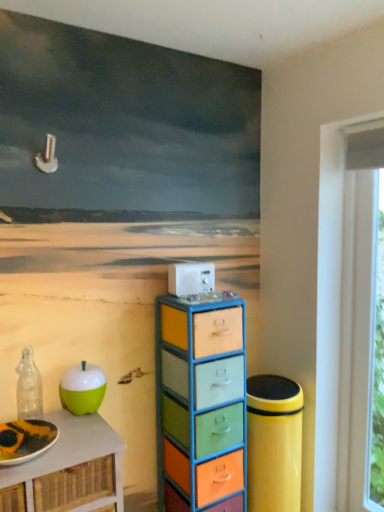
Where is `white plastic appliance at center`? white plastic appliance at center is located at coordinates (191, 278).

This screenshot has width=384, height=512. What do you see at coordinates (82, 388) in the screenshot? I see `green matte apple at lower left` at bounding box center [82, 388].

The height and width of the screenshot is (512, 384). What do you see at coordinates (331, 298) in the screenshot?
I see `white plastic window frame at right` at bounding box center [331, 298].

Describe the element at coordinates (25, 440) in the screenshot. I see `matte white plate at lower left` at that location.

At what (x,y) coordinates should I click in order to perform the action: click on green matte apple at left. Please return your answer as a coordinate pair (x, y). This screenshot has height=512, width=384. Looking at the image, I should click on (x=72, y=468).

This screenshot has width=384, height=512. In order to click on white plastic appliance at center in this screenshot , I will do `click(191, 278)`.

Are green matte apple at left and white plastic window frame at right far apart?

Yes, green matte apple at left and white plastic window frame at right are quite far apart.

Can we say green matte apple at left lies outside white plastic window frame at right?

Yes.

Which object is closer to the camera, green matte apple at left or white plastic window frame at right?

green matte apple at left is more forward.

Does green matte apple at left appear on the right side of white plastic window frame at right?

Incorrect, green matte apple at left is not on the right side of white plastic window frame at right.

Are green matte apple at left and green matte apple at lower left located far from each other?

No, green matte apple at left is not far from green matte apple at lower left.

In terms of height, does green matte apple at left look taller or shorter compared to green matte apple at lower left?

Clearly, green matte apple at left is taller compared to green matte apple at lower left.

Is green matte apple at left completely or partially outside of green matte apple at lower left?

Absolutely, green matte apple at left is external to green matte apple at lower left.

From a real-world perspective, is green matte apple at left on green matte apple at lower left?

No, from a real-world perspective, green matte apple at left is not above green matte apple at lower left.

You are a GUI agent. You are given a task and a screenshot of the screen. Output one action in this format:
    pyautogui.click(x=<x>, y=<y>)
    Task: Click on the appliance lying above the multicolored painted drawers at center (from the image's perspective)
    
    Given the screenshot: What is the action you would take?
    pyautogui.click(x=191, y=278)

In the scene shown: Is white plastic appliance at center not close to multicolored painted drawers at center?

No, white plastic appliance at center is not far away from multicolored painted drawers at center.

Does point (214, 277) come in front of point (233, 467)?

No, (214, 277) is behind (233, 467).

Could you tell me if white plastic appliance at center is facing multicolored painted drawers at center?

No.

Which object is further away from the camera, matte white plate at lower left or multicolored painted drawers at center?

multicolored painted drawers at center is more distant.

From a real-world perspective, is matte white plate at lower left positioned above or below multicolored painted drawers at center?

In terms of real-world spatial position, matte white plate at lower left is above multicolored painted drawers at center.

Which is farther from the camera, (28, 429) or (221, 471)?

The point (221, 471) is behind.

The width and height of the screenshot is (384, 512). Identify the location of the chest of drawers beneath the matte white plate at lower left (from a real-world perspective). click(x=201, y=400).

How many degrees apart are the facing directions of white plastic appliance at center and green matte apple at lower left?

white plastic appliance at center and green matte apple at lower left are facing 1.58 degrees away from each other.

Considering the sizes of objects white plastic appliance at center and green matte apple at lower left in the image provided, who is bigger, white plastic appliance at center or green matte apple at lower left?

green matte apple at lower left is bigger.

Find the location of a particular element. apple that is below the white plastic appliance at center (from the image's perspective) is located at coordinates (82, 388).

Is white plastic appliance at center positioned with its back to green matte apple at lower left?

white plastic appliance at center does not have its back to green matte apple at lower left.

How many degrees apart are the facing directions of green matte apple at left and multicolored painted drawers at center?

0.879 degrees.

From a real-world perspective, is green matte apple at left beneath multicolored painted drawers at center?

Indeed, from a real-world perspective, green matte apple at left is positioned beneath multicolored painted drawers at center.

Could you tell me if green matte apple at left is facing multicolored painted drawers at center?

No, green matte apple at left does not turn towards multicolored painted drawers at center.

Relative to multicolored painted drawers at center, is green matte apple at left in front or behind?

In the image, green matte apple at left appears in front of multicolored painted drawers at center.

Is matte white plate at lower left touching white plastic appliance at center?

No, matte white plate at lower left is not with white plastic appliance at center.

How different are the orientations of matte white plate at lower left and white plastic appliance at center in degrees?

0.366 degrees.

From a real-world perspective, between matte white plate at lower left and white plastic appliance at center, who is vertically higher?

white plastic appliance at center.

Can you confirm if matte white plate at lower left is thinner than white plastic appliance at center?

In fact, matte white plate at lower left might be wider than white plastic appliance at center.

Find the location of a particular element. This screenshot has height=512, width=384. window frame that is behind the green matte apple at left is located at coordinates (331, 298).

At what (x,y) coordinates should I click in order to perform the action: click on table that is in front of the green matte apple at lower left. Please return your answer as a coordinate pair (x, y). The height and width of the screenshot is (512, 384). Looking at the image, I should click on (72, 468).

Looking at the image, which one is located closer to multicolored painted drawers at center, matte white plate at lower left or white plastic window frame at right?

white plastic window frame at right is closer to multicolored painted drawers at center.

Looking at the image, which one is located closer to green matte apple at left, white plastic window frame at right or transparent glass bottle at left?

transparent glass bottle at left is closer to green matte apple at left.

Based on their spatial positions, is white plastic appliance at center or green matte apple at lower left further from matte white plate at lower left?

Based on the image, white plastic appliance at center appears to be further to matte white plate at lower left.

From the image, which object appears to be nearer to green matte apple at lower left, white plastic appliance at center or transparent glass bottle at left?

Among the two, transparent glass bottle at left is located nearer to green matte apple at lower left.

Which object lies further to the anchor point multicolored painted drawers at center, transparent glass bottle at left or matte white plate at lower left?

matte white plate at lower left.

Based on their spatial positions, is matte white plate at lower left or green matte apple at left closer to white plastic appliance at center?

The object closer to white plastic appliance at center is green matte apple at left.

Based on their spatial positions, is multicolored painted drawers at center or green matte apple at lower left closer to transparent glass bottle at left?

Among the two, green matte apple at lower left is located nearer to transparent glass bottle at left.

From the image, which object appears to be nearer to white plastic window frame at right, white plastic appliance at center or transparent glass bottle at left?

Based on the image, white plastic appliance at center appears to be nearer to white plastic window frame at right.

You are a GUI agent. You are given a task and a screenshot of the screen. Output one action in this format:
    pyautogui.click(x=<x>, y=<y>)
    Task: Click on the chest of drawers located between green matte apple at left and white plastic window frame at right in the left-right direction
    
    Given the screenshot: What is the action you would take?
    201,400

What are the coordinates of `apple located between green matte apple at left and white plastic window frame at right in the left-right direction` in the screenshot? It's located at (82, 388).

Image resolution: width=384 pixels, height=512 pixels. What are the coordinates of `plate between transparent glass bottle at left and white plastic window frame at right in the horizontal direction` in the screenshot? It's located at (25, 440).

This screenshot has height=512, width=384. In order to click on chest of drawers between green matte apple at lower left and white plastic window frame at right in the horizontal direction in this screenshot , I will do `click(201, 400)`.